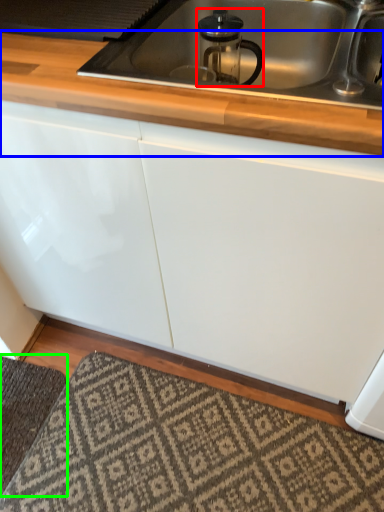
Question: Based on their relative distances, which object is farther from appliance (highlighted by a red box)? Choose from countertop (highlighted by a blue box) and doormat (highlighted by a green box).

Choices:
 (A) countertop
 (B) doormat

Answer: (B)